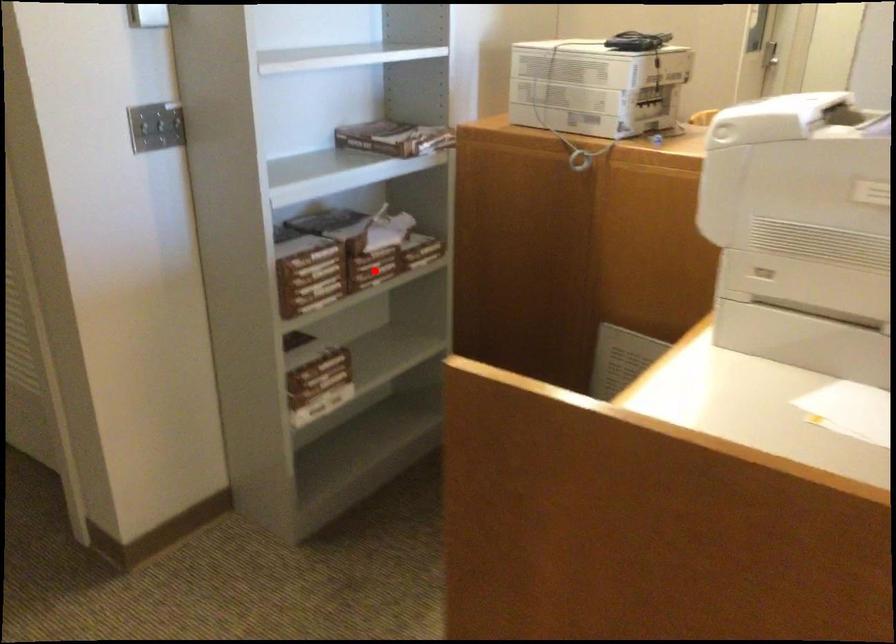
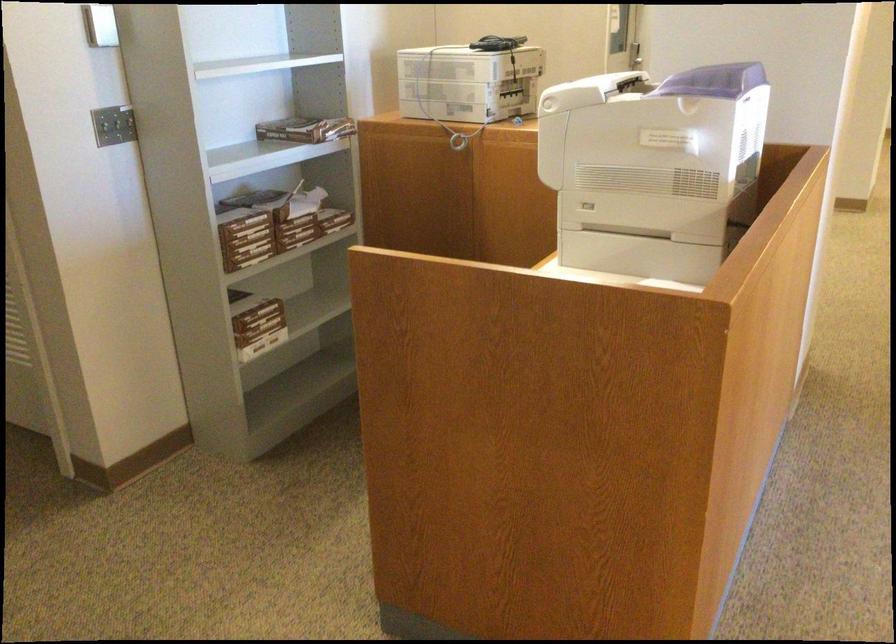
In the second image, find the point that corresponds to the highlighted location in the first image.

(297, 231)